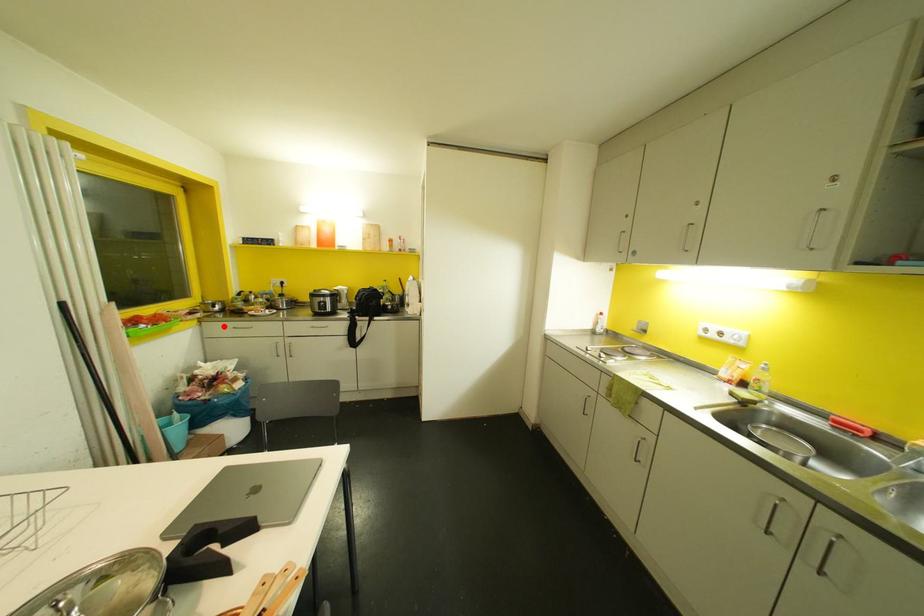
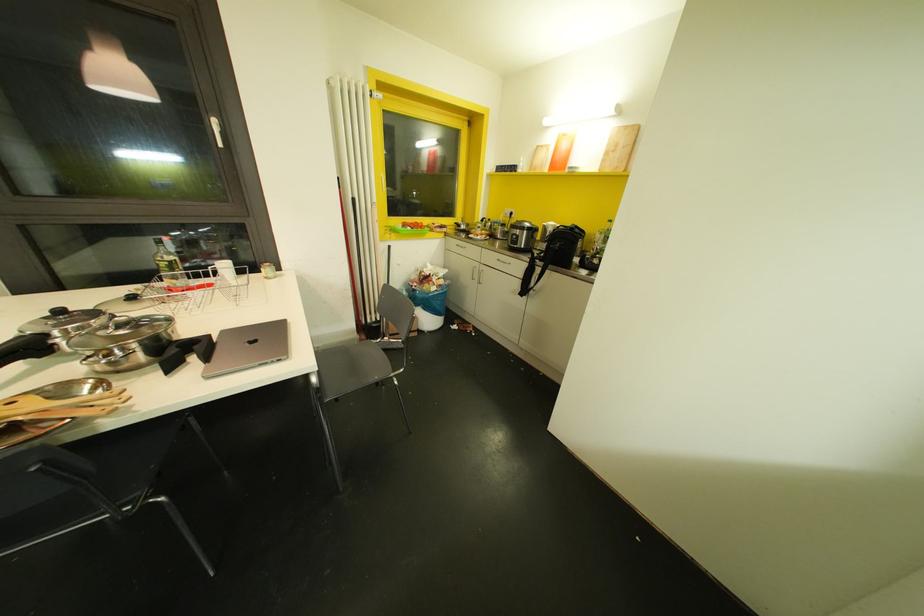
Question: I am providing you with two images of the same scene from different viewpoints. Image1 has a red point marked. In image2, the corresponding 3D location appears at what relative position? Reply with the corresponding letter.

Choices:
 (A) Closer
 (B) Farther

Answer: (A)